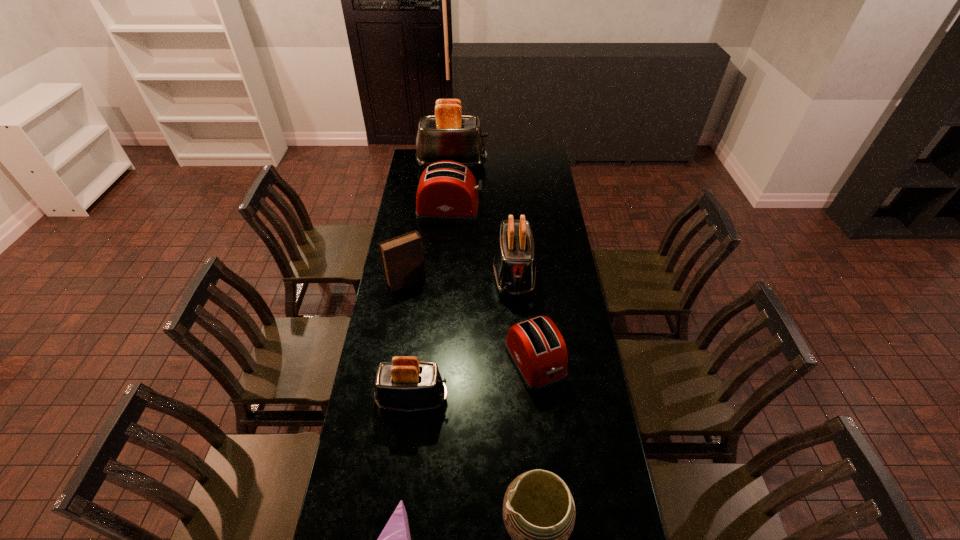
The width and height of the screenshot is (960, 540). What are the coordinates of `vacant space situated on the side of the biggest gray toaster with the control lever` in the screenshot? It's located at (533, 165).

Image resolution: width=960 pixels, height=540 pixels. I want to click on free space located 0.310m on the side of the second nearest gray toaster with the control lever, so click(x=520, y=368).

Where is `vacant area situated 0.120m on the back of the farther red toaster`? This screenshot has height=540, width=960. vacant area situated 0.120m on the back of the farther red toaster is located at coordinates (452, 185).

Identify the location of vacant space located 0.380m on the right of the Bible. (512, 282).

The width and height of the screenshot is (960, 540). I want to click on vacant region located on the side of the nearest gray toaster with the control lever, so click(462, 399).

Image resolution: width=960 pixels, height=540 pixels. I want to click on free spot located on the back of the second shortest object, so click(527, 281).

At what (x,y) coordinates should I click in order to perform the action: click on object at the far edge. Please return your answer as a coordinate pair (x, y). This screenshot has width=960, height=540. Looking at the image, I should click on (448, 135).

Locate an element on the screen. The image size is (960, 540). Bible that is at the left edge is located at coordinates (402, 258).

At what (x,y) coordinates should I click in order to perform the action: click on object that is at the right edge. Please return your answer as a coordinate pair (x, y). Looking at the image, I should click on (536, 347).

Image resolution: width=960 pixels, height=540 pixels. I want to click on object located at the far left corner, so click(448, 135).